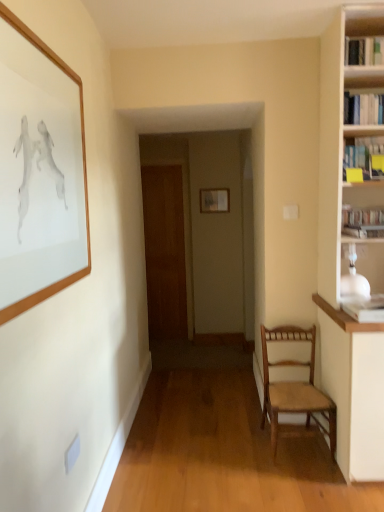
Question: Is yellow paper at upper right, which is the second book in bottom-to-top order, to the left of wooden picture frame at upper left, placed as the first picture frame when sorted from left to right, from the viewer's perspective?

Choices:
 (A) yes
 (B) no

Answer: (B)

Question: From the image's perspective, does yellow paper at upper right, which is counted as the 3th book, starting from the top, appear lower than wooden picture frame at upper left, placed as the first picture frame when sorted from left to right?

Choices:
 (A) yes
 (B) no

Answer: (B)

Question: Is yellow paper at upper right, which is counted as the 3th book, starting from the top, thinner than wooden picture frame at upper left, the first picture frame viewed from the front?

Choices:
 (A) yes
 (B) no

Answer: (B)

Question: Would you say yellow paper at upper right, which is counted as the 3th book, starting from the top, is outside wooden picture frame at upper left, which is the second picture frame from right to left?

Choices:
 (A) yes
 (B) no

Answer: (A)

Question: Is yellow paper at upper right, which is counted as the 3th book, starting from the top, beside wooden picture frame at upper left, placed as the first picture frame when sorted from left to right?

Choices:
 (A) no
 (B) yes

Answer: (A)

Question: Considering the relative sizes of yellow paper at upper right, which is counted as the 3th book, starting from the top, and wooden picture frame at upper left, which is the second picture frame from right to left, in the image provided, is yellow paper at upper right, which is counted as the 3th book, starting from the top, smaller than wooden picture frame at upper left, which is the second picture frame from right to left,?

Choices:
 (A) yes
 (B) no

Answer: (A)

Question: Is the surface of wooden woven seat chair at lower right in direct contact with wooden picture frame at upper left, placed as the first picture frame when sorted from left to right?

Choices:
 (A) yes
 (B) no

Answer: (B)

Question: Does wooden woven seat chair at lower right come behind wooden picture frame at upper left, placed as the first picture frame when sorted from left to right?

Choices:
 (A) no
 (B) yes

Answer: (B)

Question: From a real-world perspective, does wooden woven seat chair at lower right sit lower than wooden picture frame at upper left, the first picture frame viewed from the front?

Choices:
 (A) no
 (B) yes

Answer: (B)

Question: Considering the relative sizes of wooden woven seat chair at lower right and wooden picture frame at upper left, the first picture frame viewed from the front, in the image provided, is wooden woven seat chair at lower right bigger than wooden picture frame at upper left, the first picture frame viewed from the front,?

Choices:
 (A) no
 (B) yes

Answer: (B)

Question: Does wooden woven seat chair at lower right have a lesser height compared to wooden picture frame at upper left, the first picture frame viewed from the front?

Choices:
 (A) no
 (B) yes

Answer: (B)

Question: Is wooden woven seat chair at lower right facing towards wooden picture frame at upper left, placed as the first picture frame when sorted from left to right?

Choices:
 (A) yes
 (B) no

Answer: (B)

Question: Can you confirm if hardcover book at right, which appears as the 1th book when ordered from the bottom, is wider than wooden picture frame at upper left, placed as the first picture frame when sorted from left to right?

Choices:
 (A) yes
 (B) no

Answer: (A)